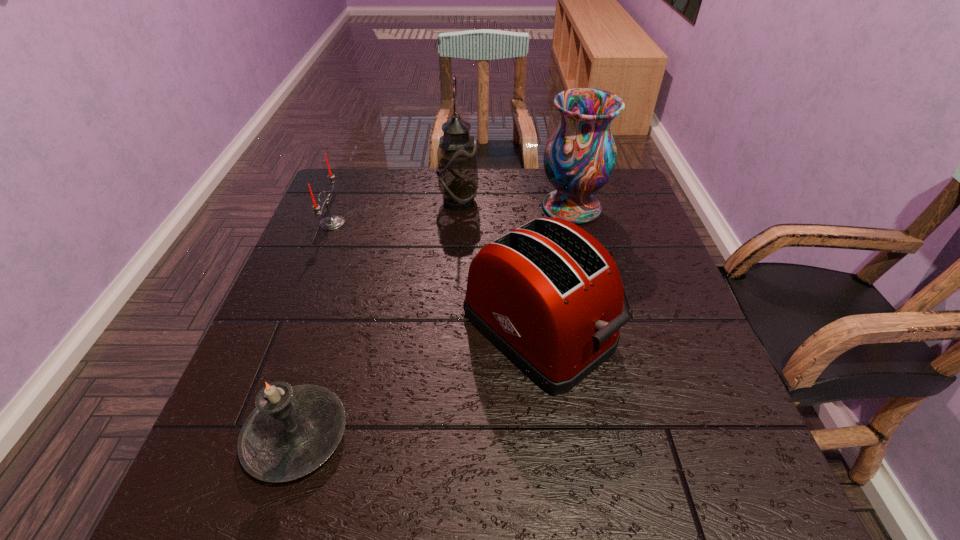
Locate an element on the screen. free area in between the third tallest object and the farther candle is located at coordinates (x=435, y=276).

Identify the location of free point between the farther candle and the third shortest object. This screenshot has height=540, width=960. (435, 276).

The height and width of the screenshot is (540, 960). What are the coordinates of `empty space between the nearer candle and the third tallest object` in the screenshot? It's located at (418, 382).

Point out which object is positioned as the third nearest to the farther candle. Please provide its 2D coordinates. Your answer should be formatted as a tuple, i.e. [(x, y)], where the tuple contains the x and y coordinates of a point satisfying the conditions above.

[(292, 431)]

Select which object is the fourth closest to the toaster. Please provide its 2D coordinates. Your answer should be formatted as a tuple, i.e. [(x, y)], where the tuple contains the x and y coordinates of a point satisfying the conditions above.

[(332, 222)]

Locate an element on the screen. The image size is (960, 540). free space that satisfies the following two spatial constraints: 1. on the back side of the third tallest object; 2. on the left side of the fourth shortest object is located at coordinates (523, 207).

At what (x,y) coordinates should I click in order to perform the action: click on vacant point that satisfies the following two spatial constraints: 1. on the back side of the nearer candle; 2. on the right side of the toaster. Please return your answer as a coordinate pair (x, y). Looking at the image, I should click on (330, 329).

This screenshot has width=960, height=540. Find the location of `vacant position in the image that satisfies the following two spatial constraints: 1. on the back side of the nearer candle; 2. on the right side of the oil lamp`. vacant position in the image that satisfies the following two spatial constraints: 1. on the back side of the nearer candle; 2. on the right side of the oil lamp is located at coordinates (371, 202).

Locate an element on the screen. This screenshot has height=540, width=960. vacant area in the image that satisfies the following two spatial constraints: 1. on the back side of the nearer candle; 2. on the right side of the oil lamp is located at coordinates click(371, 202).

Find the location of a particular element. free space that satisfies the following two spatial constraints: 1. on the front-facing side of the farther candle; 2. on the back side of the third tallest object is located at coordinates (291, 329).